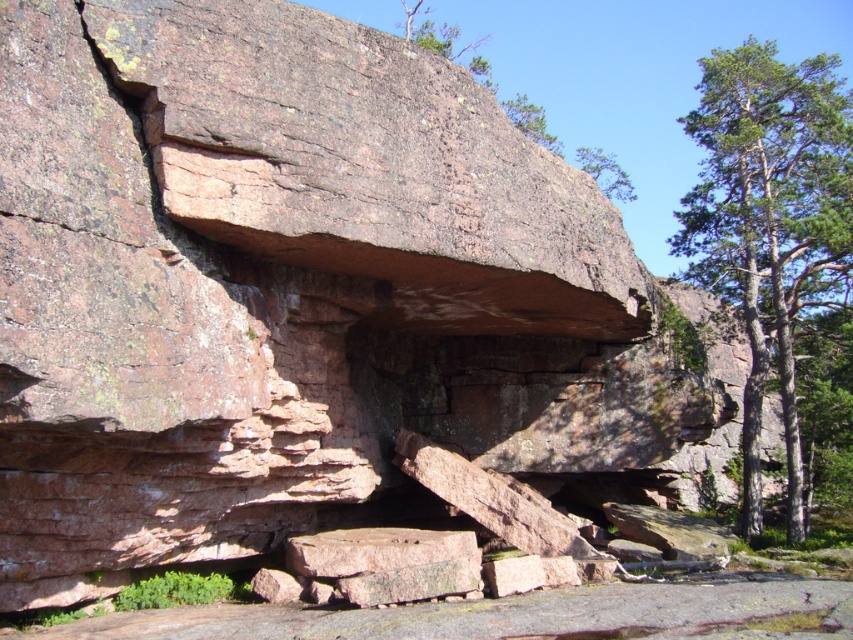
How far apart are green textured tree at right and green leafy tree at upper center?

17.71 meters

In order to click on green textured tree at right in this screenshot , I will do `click(770, 224)`.